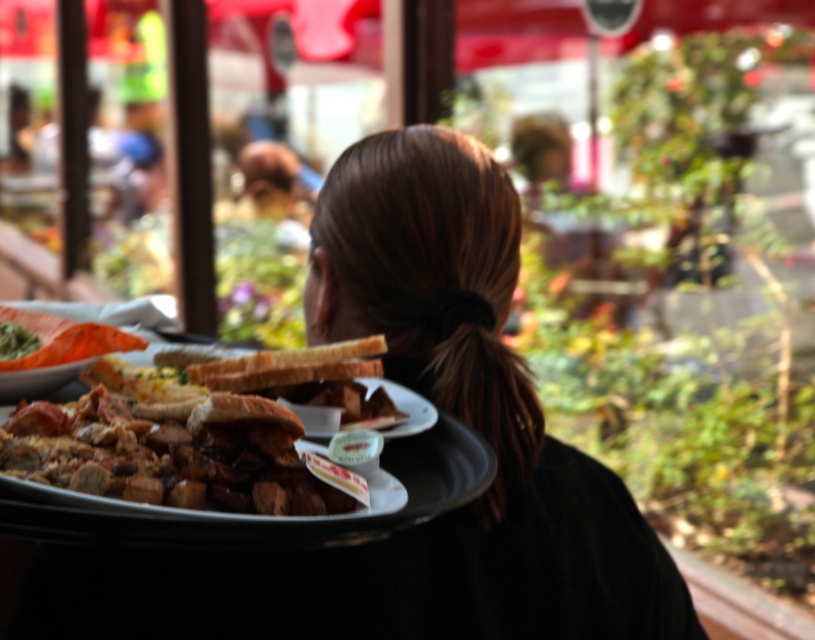
Question: Among these objects, which one is nearest to the camera?

Choices:
 (A) green matte sauce at upper left
 (B) golden brown bread at center
 (C) brown hair at center

Answer: (B)

Question: Among these points, which one is nearest to the camera?

Choices:
 (A) (394, 595)
 (B) (109, 451)

Answer: (B)

Question: Which object is farther from the camera taking this photo?

Choices:
 (A) brown hair at center
 (B) orange matte plate at upper left
 (C) golden brown bread at center

Answer: (A)

Question: Is brown hair at center in front of orange matte plate at upper left?

Choices:
 (A) yes
 (B) no

Answer: (B)

Question: Is golden brown bread at center to the right of green matte sauce at upper left from the viewer's perspective?

Choices:
 (A) yes
 (B) no

Answer: (A)

Question: Can you confirm if golden brown bread at center is smaller than orange matte plate at upper left?

Choices:
 (A) yes
 (B) no

Answer: (B)